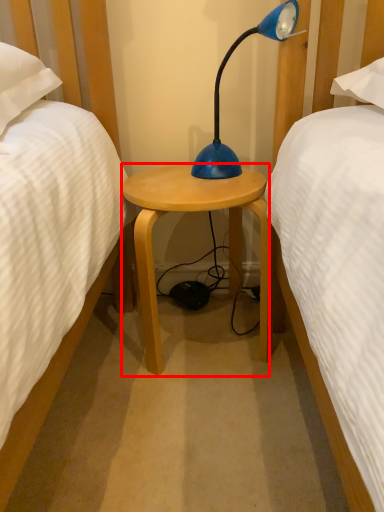
Question: From the image, what is the correct spatial relationship of stool (annotated by the red box) in relation to lamp?

Choices:
 (A) right
 (B) left

Answer: (B)